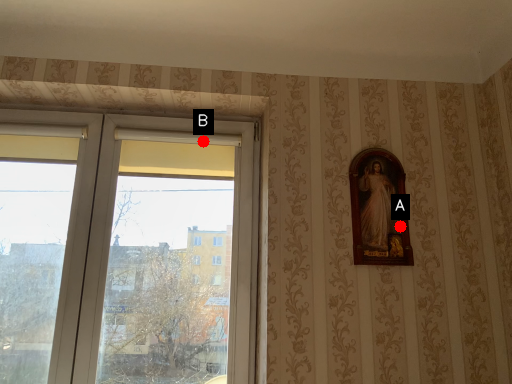
Question: Two points are circled on the image, labeled by A and B beside each circle. Which of the following is the farthest from the observer?

Choices:
 (A) A is further
 (B) B is further

Answer: (B)